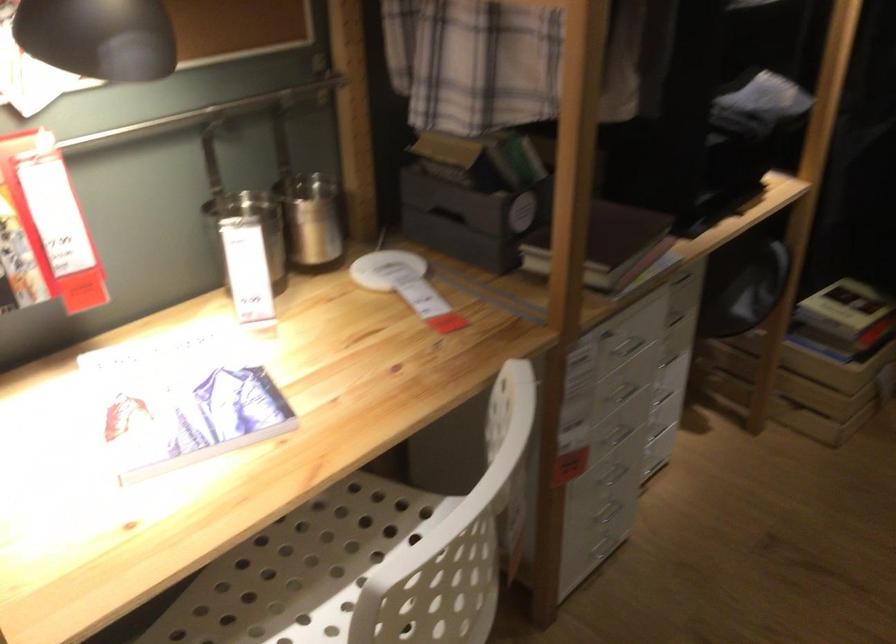
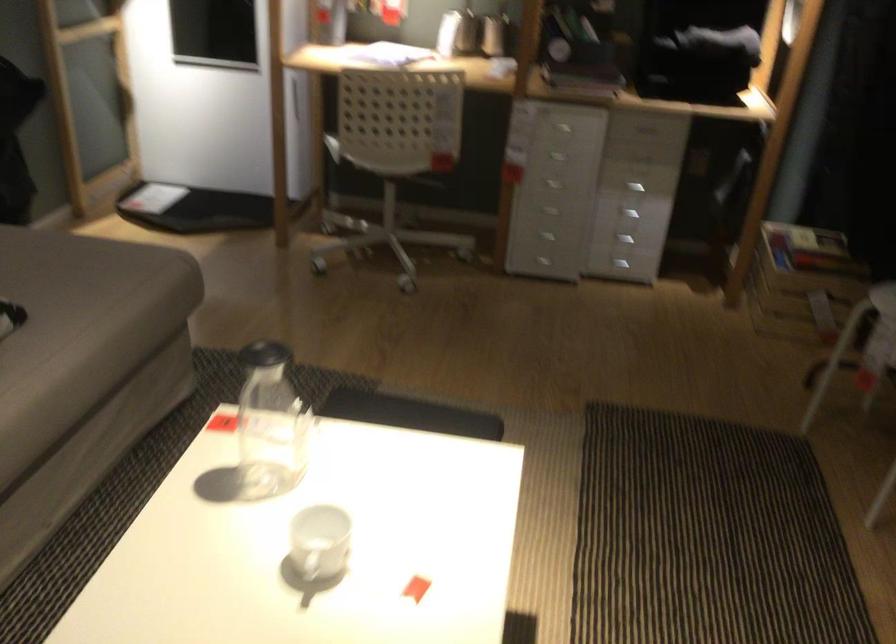
The point at (615, 353) is marked in the first image. Where is the corresponding point in the second image?

(563, 128)